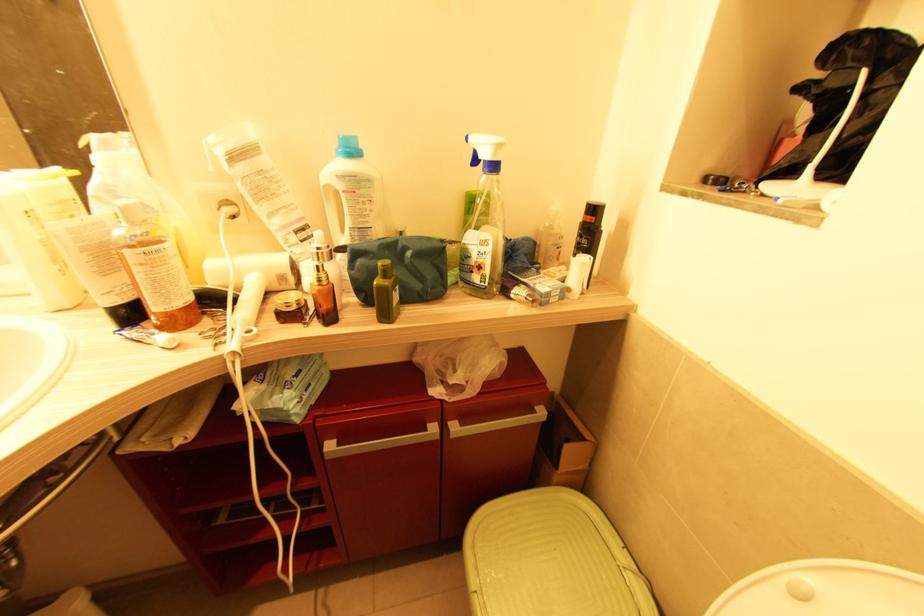
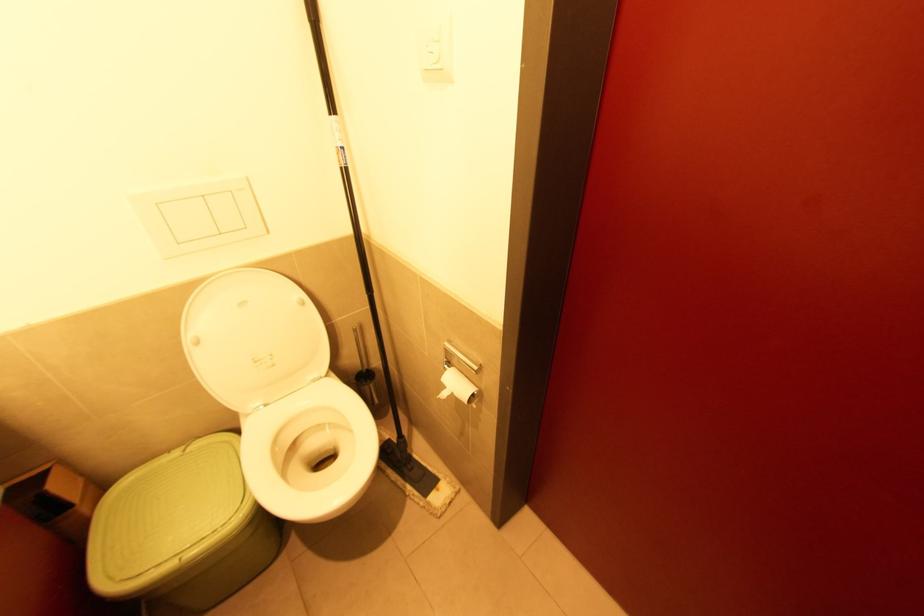
Where in the second image is the point corresponding to pixel 626 570 from the first image?

(187, 452)